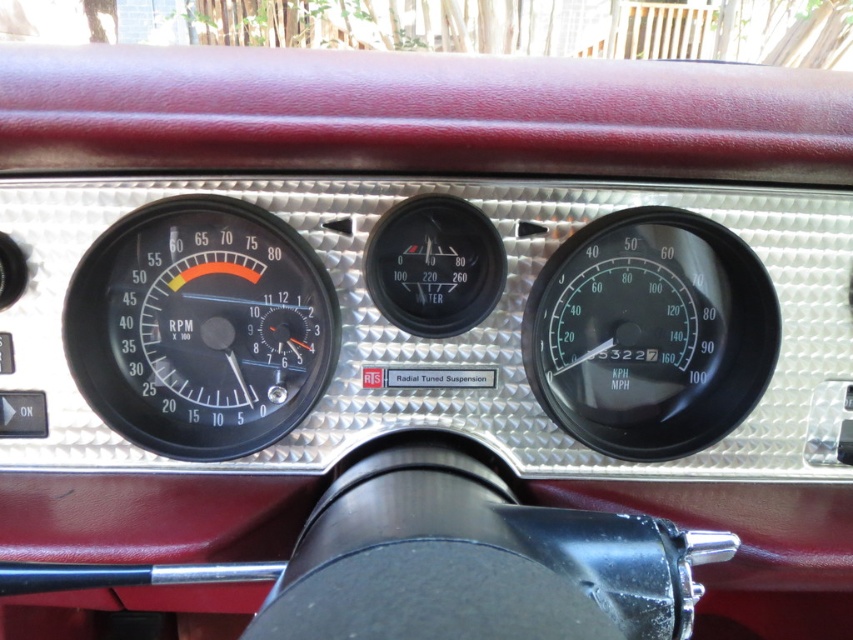
Question: Does black rubber tachometer at left come in front of black plastic speedometer at center right?

Choices:
 (A) yes
 (B) no

Answer: (A)

Question: Which object is closer to the camera taking this photo?

Choices:
 (A) black plastic speedometer at center right
 (B) black rubber tachometer at left

Answer: (B)

Question: Among these objects, which one is nearest to the camera?

Choices:
 (A) black rubber tachometer at left
 (B) black plastic speedometer at center right

Answer: (A)

Question: Does black rubber tachometer at left appear on the left side of black plastic speedometer at center right?

Choices:
 (A) no
 (B) yes

Answer: (B)

Question: Does black rubber tachometer at left appear on the right side of black plastic speedometer at center right?

Choices:
 (A) no
 (B) yes

Answer: (A)